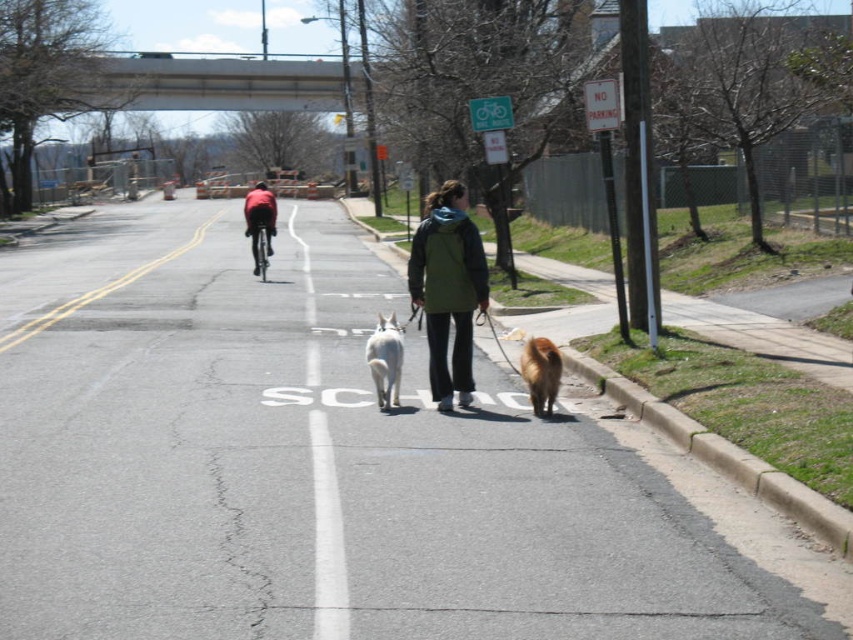
Can you confirm if red fabric jacket at center is bigger than shiny metallic bicycle at center?

Yes, red fabric jacket at center is bigger than shiny metallic bicycle at center.

Between point (250, 244) and point (256, 228), which one is positioned in front?

Positioned in front is point (256, 228).

I want to click on red fabric jacket at center, so click(259, 220).

Does white fur dog at center appear over red fabric jacket at center?

Actually, white fur dog at center is below red fabric jacket at center.

Is white fur dog at center behind red fabric jacket at center?

No, it is in front of red fabric jacket at center.

The height and width of the screenshot is (640, 853). In order to click on white fur dog at center in this screenshot , I will do `click(386, 360)`.

Where is `white fur dog at center`? white fur dog at center is located at coordinates (386, 360).

Does white fur dog at center appear under brown furry dog at center?

Incorrect, white fur dog at center is not positioned below brown furry dog at center.

Who is more forward, (x=384, y=330) or (x=558, y=372)?

Positioned in front is point (x=558, y=372).

Between point (397, 324) and point (531, 396), which one is positioned behind?

The point (397, 324) is behind.

Where is `white fur dog at center`? white fur dog at center is located at coordinates (386, 360).